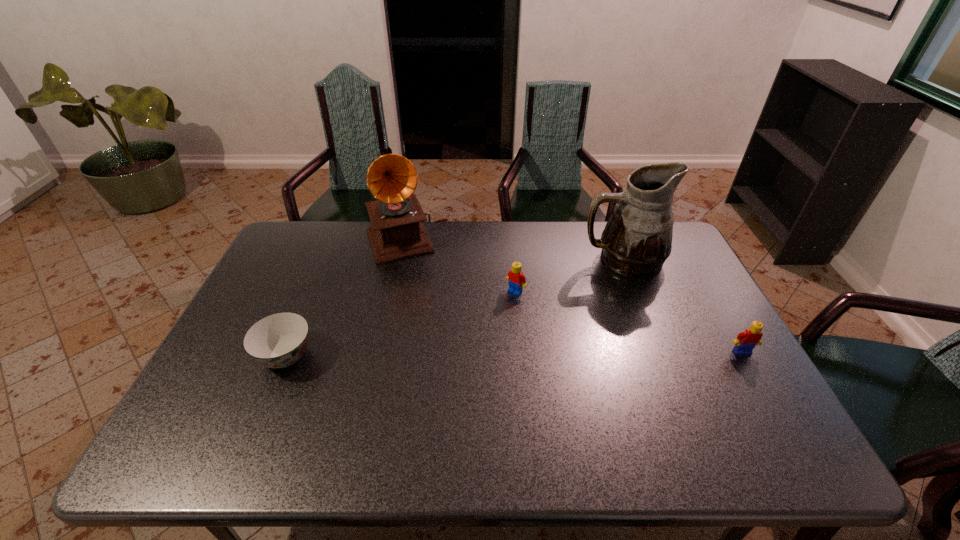
Locate an element on the screen. soup bowl is located at coordinates (278, 340).

I want to click on the leftmost object, so click(278, 340).

What are the coordinates of `the right Lego` in the screenshot? It's located at (746, 341).

Where is `the rightmost object`? This screenshot has width=960, height=540. the rightmost object is located at coordinates (746, 341).

Locate an element on the screen. phonograph record is located at coordinates (397, 232).

Identify the location of pitcher. The height and width of the screenshot is (540, 960). (637, 239).

Identify the location of the farther Lego. (516, 280).

Locate an element on the screen. the left Lego is located at coordinates (516, 280).

I want to click on free space located 0.260m on the back of the shortest object, so click(322, 272).

Locate an element on the screen. The width and height of the screenshot is (960, 540). vacant space situated on the face of the nearer Lego is located at coordinates (765, 392).